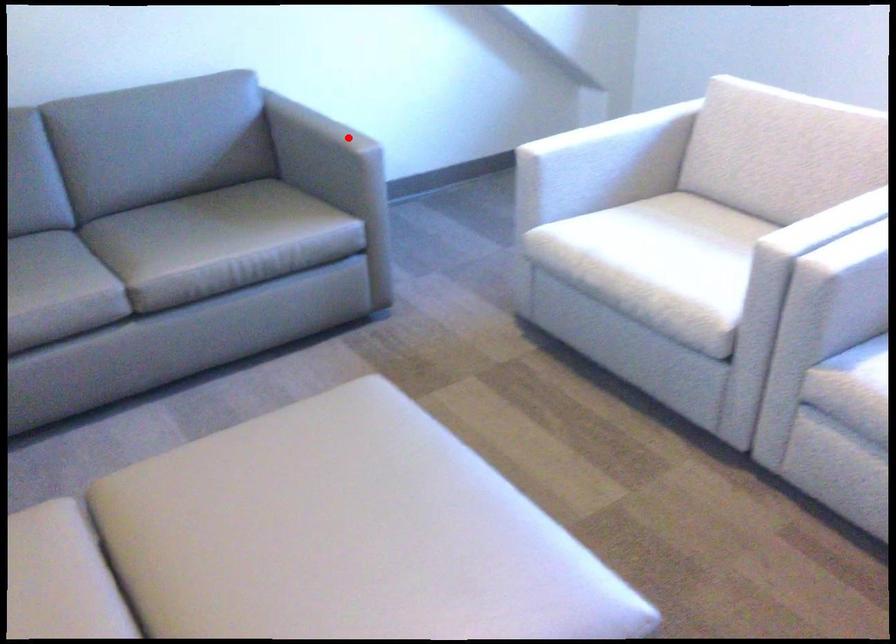
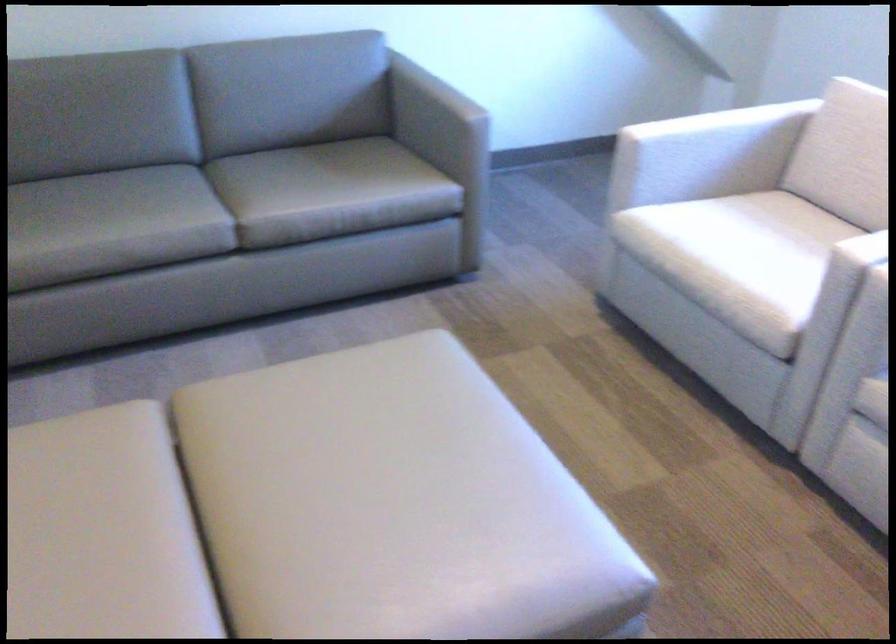
Locate, in the second image, the point that corresponds to the highlighted location in the first image.

(457, 104)